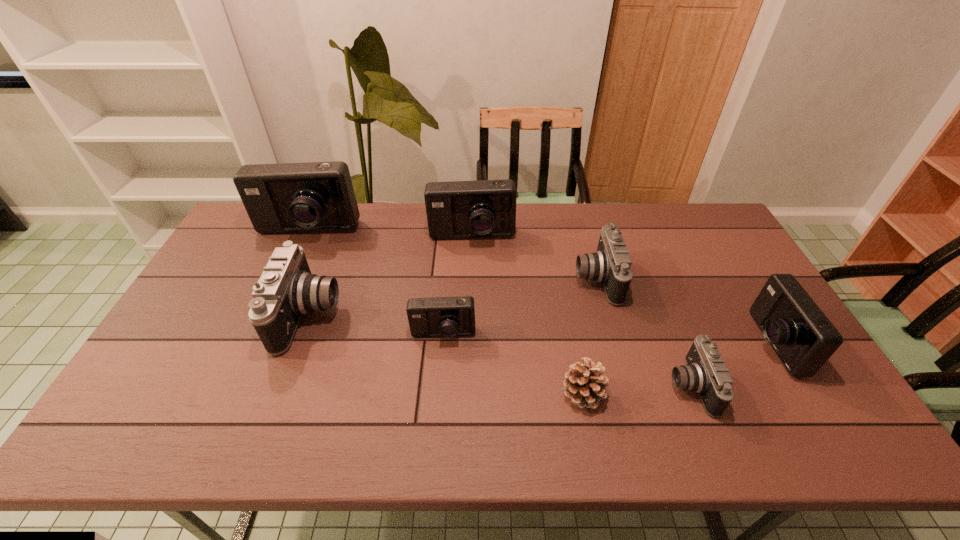
You are a GUI agent. You are given a task and a screenshot of the screen. Output one action in this format:
    pyautogui.click(x=<x>, y=<y>)
    Task: Click on the free space located 0.130m on the front-facing side of the second black camera from left to right
    Image resolution: width=960 pixels, height=540 pixels.
    Given the screenshot: What is the action you would take?
    pyautogui.click(x=534, y=279)

Find the location of `vacant space located 0.180m on the front-facing side of the smallest blue camera`. vacant space located 0.180m on the front-facing side of the smallest blue camera is located at coordinates (438, 407).

Identify the location of vacant area situated 0.050m on the back of the brown pinecone. (577, 359).

You are a GUI agent. You are given a task and a screenshot of the screen. Output one action in this format:
    pyautogui.click(x=<x>, y=<y>)
    Task: Click on the vacant space located on the front-facing side of the smallest black camera
    The image size is (960, 540).
    Given the screenshot: What is the action you would take?
    pyautogui.click(x=582, y=386)

Identify the location of free region located 0.140m on the front-facing side of the smallest black camera. This screenshot has height=540, width=960. (614, 386).

At what (x,y) coordinates should I click in order to perform the action: click on vacant space located 0.200m on the front-facing side of the smallest black camera. Please return your answer as a coordinate pair (x, y). The image size is (960, 540). Looking at the image, I should click on (590, 386).

The image size is (960, 540). What are the coordinates of `pinecone present at the near edge` in the screenshot? It's located at (585, 386).

Where is `camera that is at the near edge`? camera that is at the near edge is located at coordinates (706, 374).

At what (x,y) coordinates should I click in order to perform the action: click on object at the left edge. Please return your answer as a coordinate pair (x, y). The width and height of the screenshot is (960, 540). Looking at the image, I should click on (316, 196).

You are a GUI agent. You are given a task and a screenshot of the screen. Output one action in this format:
    pyautogui.click(x=<x>, y=<y>)
    Task: Click on the object positioned at the right edge
    This screenshot has height=540, width=960.
    Given the screenshot: What is the action you would take?
    [803, 338]